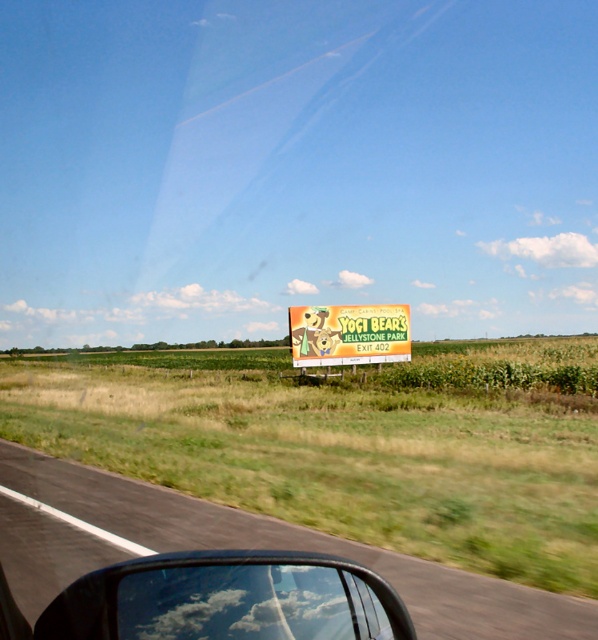
Can you confirm if black asphalt road at center is smaller than transparent glass car window at lower center?

Yes, black asphalt road at center is smaller than transparent glass car window at lower center.

Does black asphalt road at center appear under transparent glass car window at lower center?

Indeed, black asphalt road at center is positioned under transparent glass car window at lower center.

Measure the distance between point (19, 540) and camera.

5.26 meters

In order to click on black asphalt road at center in this screenshot , I will do `click(297, 548)`.

The image size is (598, 640). I want to click on black asphalt road at center, so click(297, 548).

Who is more forward, (x=282, y=529) or (x=393, y=339)?

Positioned in front is point (x=282, y=529).

Where is `black asphalt road at center`? Image resolution: width=598 pixels, height=640 pixels. black asphalt road at center is located at coordinates (297, 548).

Is transparent glass car window at lower center to the right of yellow cardboard sign at center from the viewer's perspective?

Incorrect, transparent glass car window at lower center is not on the right side of yellow cardboard sign at center.

Between transparent glass car window at lower center and yellow cardboard sign at center, which one appears on the left side from the viewer's perspective?

transparent glass car window at lower center

The width and height of the screenshot is (598, 640). I want to click on transparent glass car window at lower center, so click(x=228, y=600).